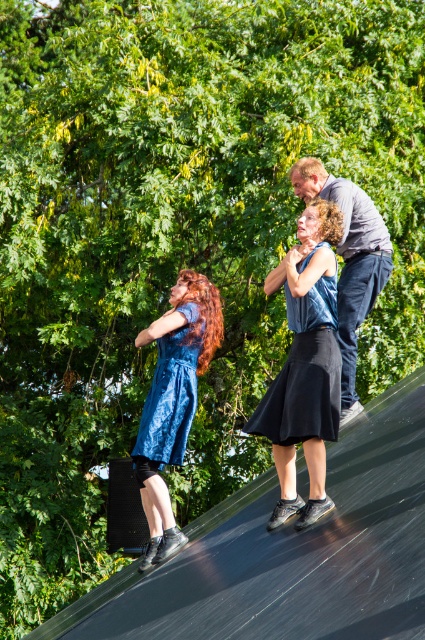
Question: Does blue satin dress at center have a greater width compared to dark gray shirt at upper right?

Choices:
 (A) yes
 (B) no

Answer: (B)

Question: Which object appears farthest from the camera in this image?

Choices:
 (A) black rubber ramp at upper center
 (B) blue lace dress at center
 (C) black matte dress at center

Answer: (B)

Question: Which point is closer to the camera?

Choices:
 (A) (231, 557)
 (B) (363, 291)
 (C) (158, 344)

Answer: (A)

Question: Which of the following is the farthest from the observer?

Choices:
 (A) blue lace dress at center
 (B) black rubber ramp at upper center
 (C) dark gray shirt at upper right
 (D) blue satin dress at center

Answer: (C)

Question: Is black matte dress at center positioned before dark gray shirt at upper right?

Choices:
 (A) yes
 (B) no

Answer: (A)

Question: Considering the relative positions of dark gray shirt at upper right and blue lace dress at center in the image provided, where is dark gray shirt at upper right located with respect to blue lace dress at center?

Choices:
 (A) above
 (B) below

Answer: (A)